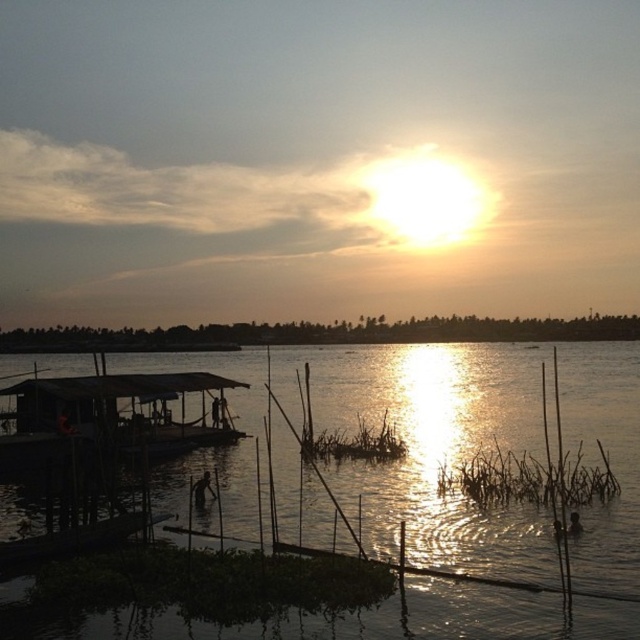
Can you confirm if translucent water at center is taller than wooden boat at left?

No.

Who is taller, translucent water at center or wooden boat at left?

With more height is wooden boat at left.

You are a GUI agent. You are given a task and a screenshot of the screen. Output one action in this format:
    pyautogui.click(x=<x>, y=<y>)
    Task: Click on the translucent water at center
    
    Given the screenshot: What is the action you would take?
    pyautogui.click(x=433, y=445)